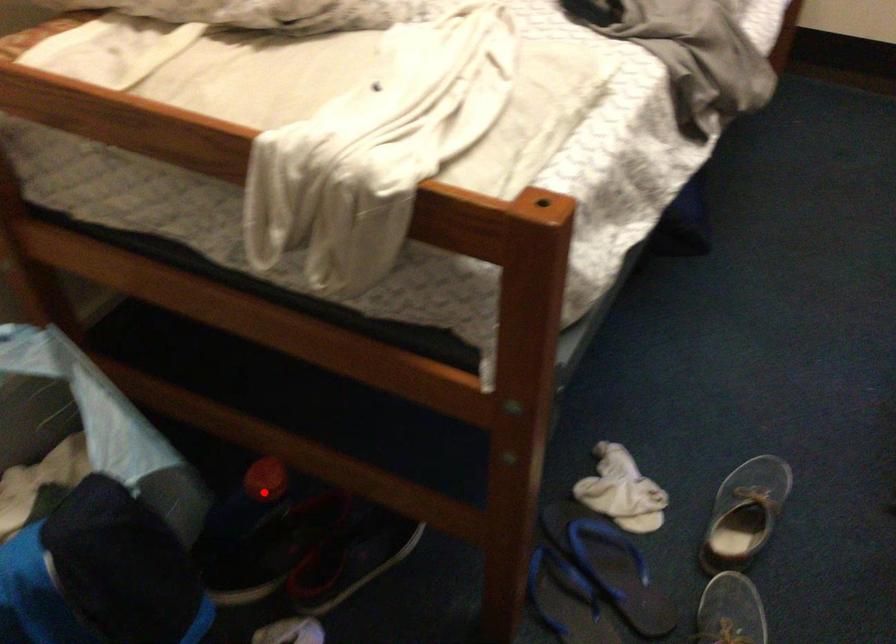
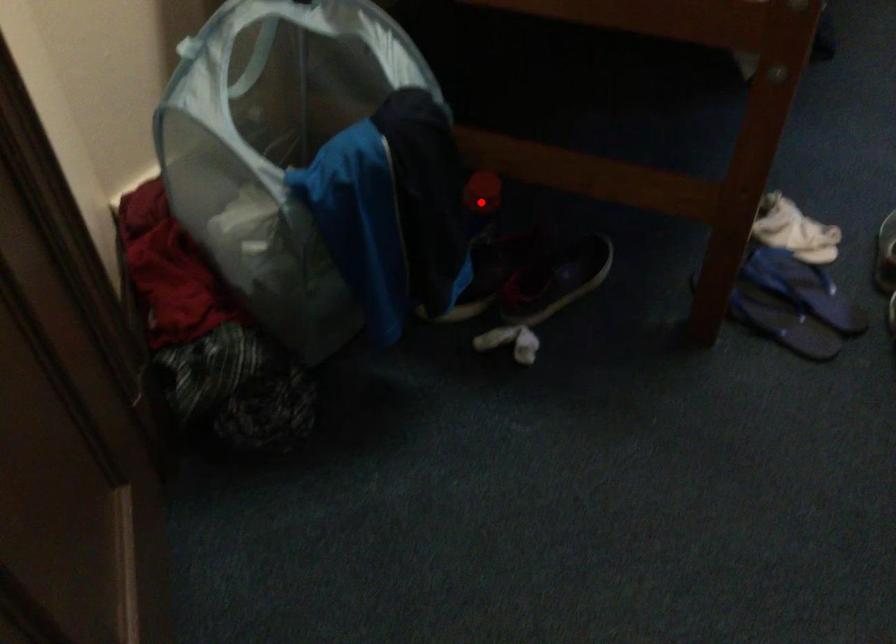
I am providing you with two images of the same scene from different viewpoints. A red point is marked on the first image and another point is marked on the second image. Is the red point in image1 aligned with the point shown in image2?

Yes